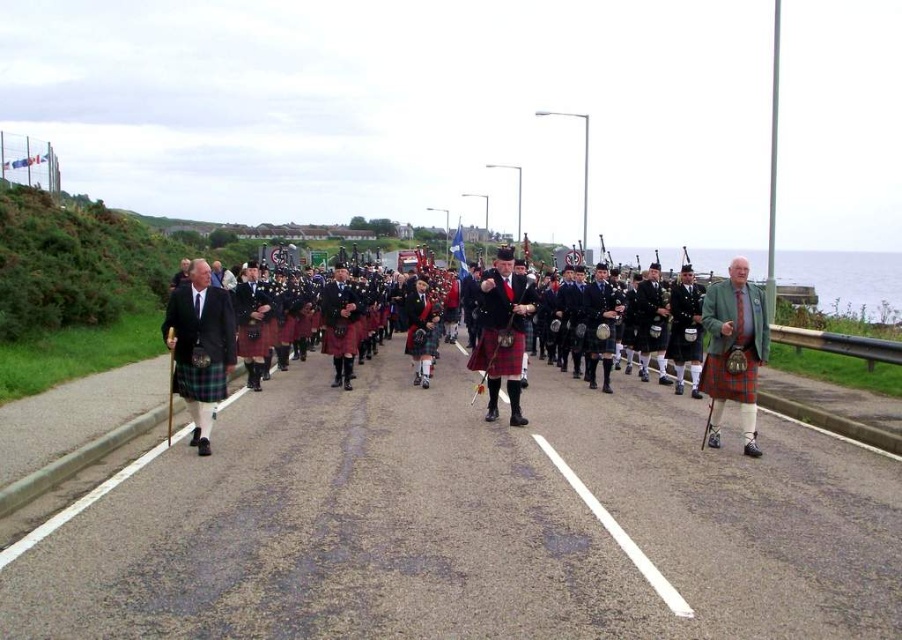
Question: Can you confirm if matte green jacket at right is positioned above matte black kilt at left?

Choices:
 (A) no
 (B) yes

Answer: (A)

Question: Which object is positioned farthest from the matte tartan kilt at center?

Choices:
 (A) matte green jacket at right
 (B) red plaid kilt at center
 (C) matte black kilt at left

Answer: (C)

Question: Which is nearer to the matte tartan kilt at center?

Choices:
 (A) matte green jacket at right
 (B) matte black kilt at left

Answer: (A)

Question: Among these objects, which one is nearest to the camera?

Choices:
 (A) matte green jacket at right
 (B) matte tartan kilt at center
 (C) red plaid kilt at center

Answer: (A)

Question: Is matte black kilt at left above matte tartan kilt at center?

Choices:
 (A) no
 (B) yes

Answer: (B)

Question: Does matte green jacket at right have a smaller size compared to red plaid kilt at center?

Choices:
 (A) yes
 (B) no

Answer: (B)